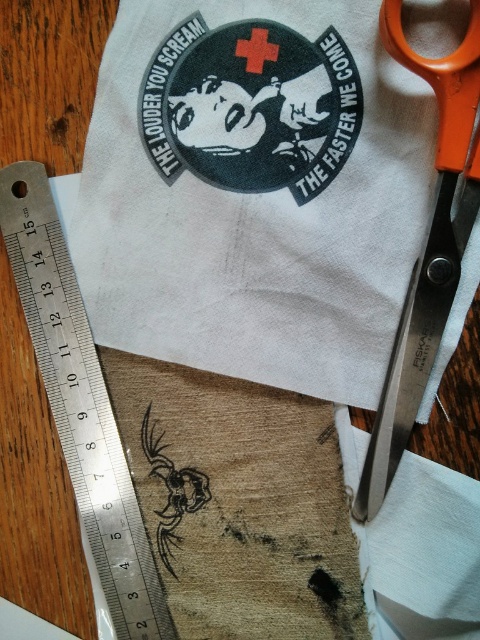
Does orange plastic scissors at right come in front of black embroidered spider at center?

Yes.

Which is in front, point (448, 230) or point (142, 420)?

Point (448, 230) is in front.

The height and width of the screenshot is (640, 480). Find the location of `orange plastic scissors at right`. orange plastic scissors at right is located at coordinates (427, 250).

Consider the image. Does white cotton cloth at center have a greater height compared to silver metallic ruler at left?

Incorrect, white cotton cloth at center's height is not larger of silver metallic ruler at left's.

Can you confirm if white cotton cloth at center is smaller than silver metallic ruler at left?

Actually, white cotton cloth at center might be larger than silver metallic ruler at left.

This screenshot has width=480, height=640. Describe the element at coordinates (254, 189) in the screenshot. I see `white cotton cloth at center` at that location.

Find the location of a particular element. The image size is (480, 640). white cotton cloth at center is located at coordinates coord(254,189).

Identify the location of white cotton cloth at center. This screenshot has width=480, height=640. (254, 189).

Can you confirm if white cotton cloth at center is positioned to the left of orange plastic scissors at right?

Correct, you'll find white cotton cloth at center to the left of orange plastic scissors at right.

Who is more forward, (289, 51) or (417, 54)?

Positioned in front is point (417, 54).

You are a GUI agent. You are given a task and a screenshot of the screen. Output one action in this format:
    pyautogui.click(x=<x>, y=<y>)
    Task: Click on the white cotton cloth at center
    The width and height of the screenshot is (480, 640).
    Given the screenshot: What is the action you would take?
    (x=254, y=189)